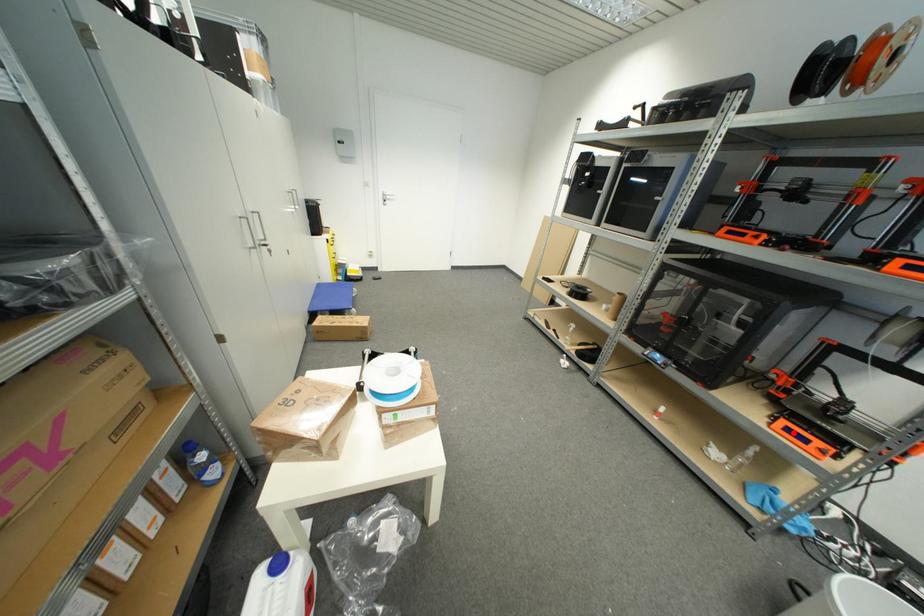
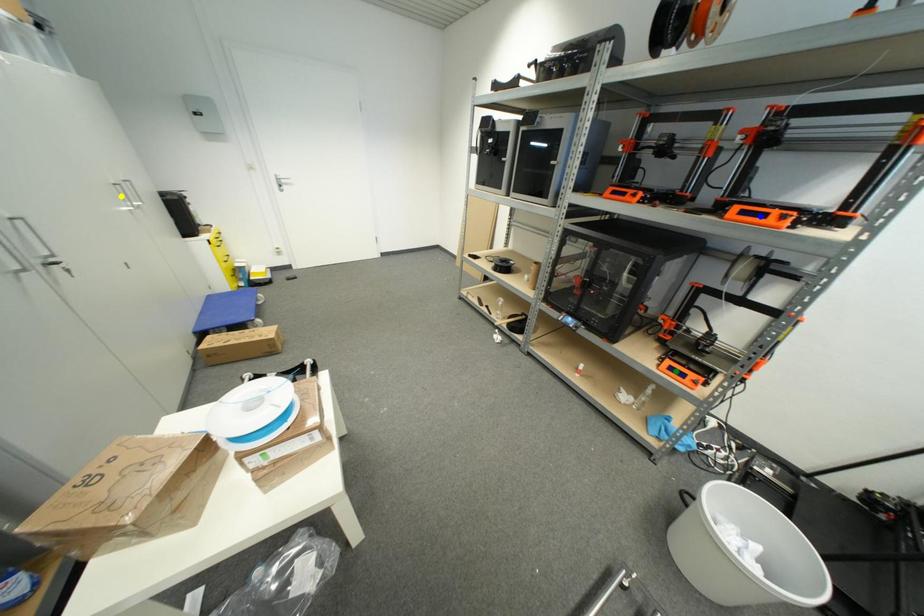
Question: I am providing you with two images of the same scene from different viewpoints. A red point is marked on the first image. You are given multiple points on the second image. Which spot in image 2 lines up with the point in image 1?

Choices:
 (A) yellow point
 (B) blue point
 (C) green point

Answer: (C)